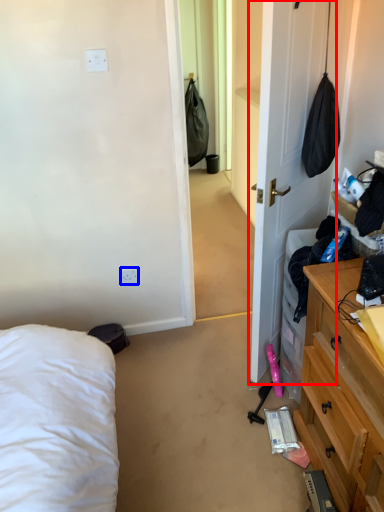
Question: Which of the following is the closest to the observer, door (highlighted by a red box) or electric outlet (highlighted by a blue box)?

Choices:
 (A) door
 (B) electric outlet

Answer: (A)